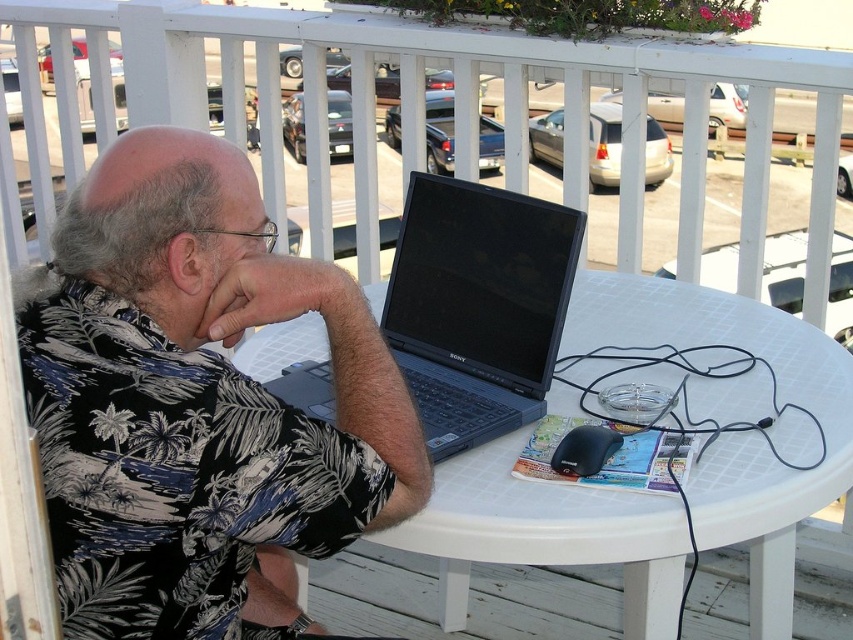
You are standing on the balcony and want to place a small plant pot between the two points marked as point (566,563) and point (277,378). Which point should the pot be closer to if it needs to be placed in front of the point closer to the man?

The pot should be placed closer to point (277,378) because point (277,378) is closer to the man and the pot needs to be in front of it.

Based on the scene description, where is the black floral shirt at center located in terms of its 2D coordinates?

The black floral shirt at center is located at the 2D coordinates of point (196, 403).

Consider the image. You are a delivery person who needs to place a small package on the table without disturbing the man. The package is 10 inches in length. Can you fit it between the black floral shirt at center and the white plastic table at center?

The black floral shirt at center is 15.88 inches away from the white plastic table at center. Since the package is only 10 inches long, it can fit in the space between them.